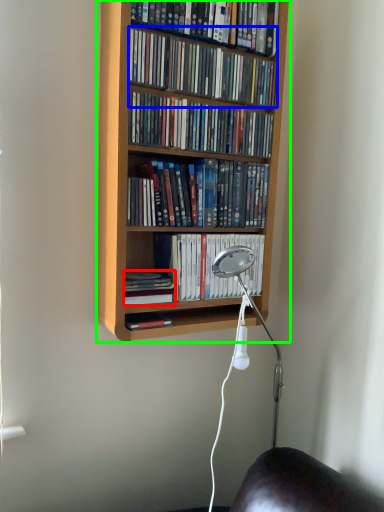
Question: Which object is positioned closest to book (highlighted by a red box)? Select from book (highlighted by a blue box) and bookcase (highlighted by a green box).

Choices:
 (A) book
 (B) bookcase

Answer: (B)